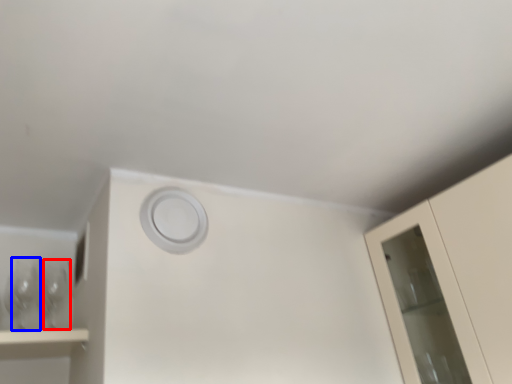
Question: Which point is further to the camera, wine glass (highlighted by a red box) or wine glass (highlighted by a blue box)?

Choices:
 (A) wine glass
 (B) wine glass

Answer: (A)